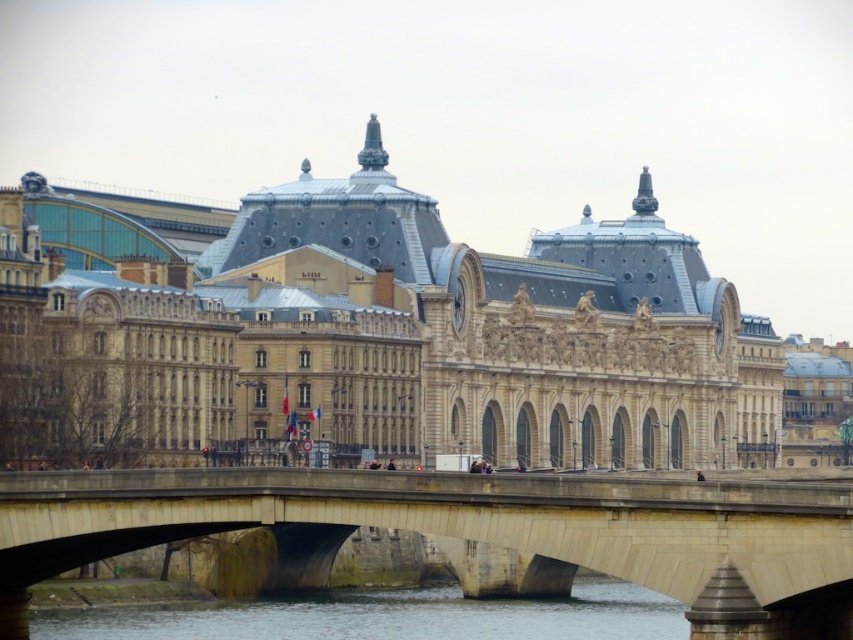
You are a tourist standing on the stone arch bridge in the foreground. You see the beige stone palace at center and the clear water at lower center. Which of these two landmarks is located to the right of the other?

The beige stone palace at center is positioned on the right side of the clear water at lower center.

You are an architect visiting the city and want to take a photo of both the beige stone palace at center and the beige stone bridge at center. Which one should you focus on first to ensure it fits entirely in the frame?

The beige stone palace at center is larger in size than the beige stone bridge at center, so you should focus on capturing the beige stone palace at center first to ensure it fits entirely in the frame before adjusting for the smaller beige stone bridge at center.

You are a tourist standing on the stone arch bridge in the foreground. You want to take a photo of the beige stone palace at center and the clear water at lower center. Which object will appear larger in your camera viewfinder?

The beige stone palace at center will appear larger in the camera viewfinder because it has a greater height compared to the clear water at lower center.